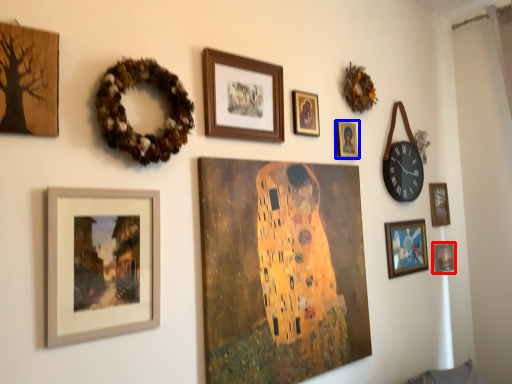
Question: Among these objects, which one is nearest to the camera, picture frame (highlighted by a red box) or picture frame (highlighted by a blue box)?

Choices:
 (A) picture frame
 (B) picture frame

Answer: (B)